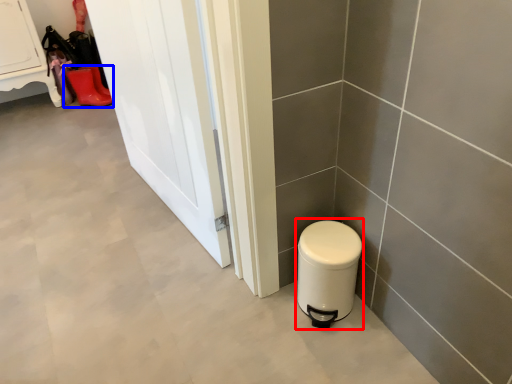
Question: Which of the following is the farthest to the observer, water heater (highlighted by a red box) or footwear (highlighted by a blue box)?

Choices:
 (A) water heater
 (B) footwear

Answer: (B)